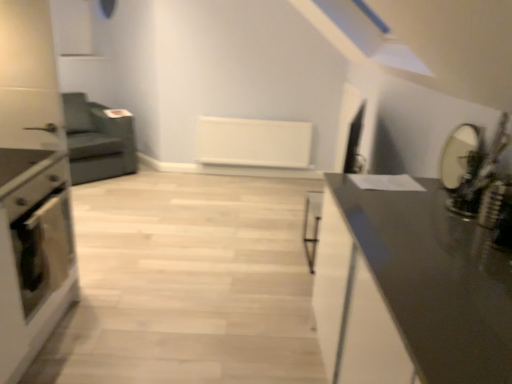
Question: From the image's perspective, is matte black oven at left below matte black oven at left?

Choices:
 (A) yes
 (B) no

Answer: (B)

Question: Can you confirm if matte black oven at left is taller than matte black oven at left?

Choices:
 (A) no
 (B) yes

Answer: (A)

Question: Is matte black oven at left further to the viewer compared to matte black oven at left?

Choices:
 (A) yes
 (B) no

Answer: (A)

Question: Is matte black oven at left next to matte black oven at left and touching it?

Choices:
 (A) no
 (B) yes

Answer: (B)

Question: Considering the relative positions of matte black oven at left and matte black oven at left in the image provided, is matte black oven at left to the left of matte black oven at left from the viewer's perspective?

Choices:
 (A) no
 (B) yes

Answer: (A)

Question: Is brushed metal drawer at left in front of or behind matte black oven at left in the image?

Choices:
 (A) behind
 (B) front

Answer: (B)

Question: Do you think brushed metal drawer at left is within matte black oven at left, or outside of it?

Choices:
 (A) outside
 (B) inside

Answer: (A)

Question: Looking at their shapes, would you say brushed metal drawer at left is wider or thinner than matte black oven at left?

Choices:
 (A) thin
 (B) wide

Answer: (B)

Question: In terms of height, does brushed metal drawer at left look taller or shorter compared to matte black oven at left?

Choices:
 (A) tall
 (B) short

Answer: (B)

Question: From a real-world perspective, relative to matte black oven at left, is matte black mirror at right vertically above or below?

Choices:
 (A) above
 (B) below

Answer: (A)

Question: Is matte black mirror at right bigger or smaller than matte black oven at left?

Choices:
 (A) small
 (B) big

Answer: (A)

Question: From the image's perspective, is matte black mirror at right located above or below matte black oven at left?

Choices:
 (A) above
 (B) below

Answer: (A)

Question: Based on their positions, is matte black mirror at right located to the left or right of matte black oven at left?

Choices:
 (A) left
 (B) right

Answer: (B)

Question: Is matte black mirror at right bigger or smaller than brushed metal drawer at left?

Choices:
 (A) big
 (B) small

Answer: (B)

Question: Considering their positions, is matte black mirror at right located in front of or behind brushed metal drawer at left?

Choices:
 (A) front
 (B) behind

Answer: (B)